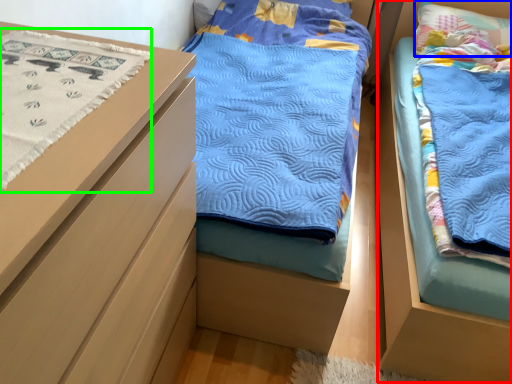
Question: Estimate the real-world distances between objects in this image. Which object is farther from bed (highlighted by a red box), pillow (highlighted by a blue box) or blanket (highlighted by a green box)?

Choices:
 (A) pillow
 (B) blanket

Answer: (A)